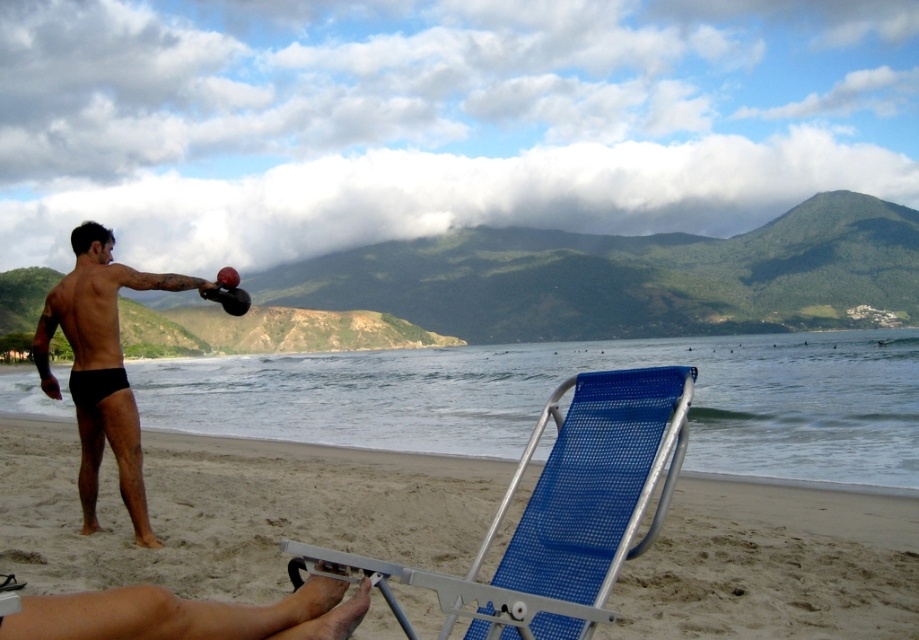
Question: Is blue mesh chair at lower center behind black matte shorts at left?

Choices:
 (A) yes
 (B) no

Answer: (B)

Question: Considering the relative positions of blue mesh beach chair at lower center and black matte shorts at left in the image provided, where is blue mesh beach chair at lower center located with respect to black matte shorts at left?

Choices:
 (A) left
 (B) right

Answer: (B)

Question: Which of the following is the closest to the observer?

Choices:
 (A) blue mesh beach chair at lower center
 (B) black matte shorts at left
 (C) blue mesh chair at lower center

Answer: (A)

Question: Among these points, which one is farthest from the camera?

Choices:
 (A) (842, 596)
 (B) (441, 602)
 (C) (142, 512)

Answer: (C)

Question: Is blue mesh chair at lower center further to camera compared to blue mesh beach chair at lower center?

Choices:
 (A) no
 (B) yes

Answer: (B)

Question: Which point is farther to the camera?

Choices:
 (A) blue mesh beach chair at lower center
 (B) black matte shorts at left

Answer: (B)